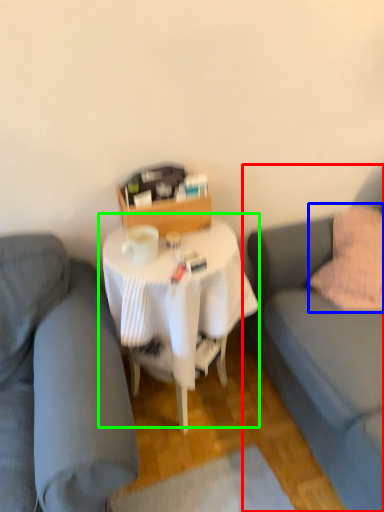
Question: Which object is positioned closest to studio couch (highlighted by a red box)? Select from throw pillow (highlighted by a blue box) and table (highlighted by a green box).

Choices:
 (A) throw pillow
 (B) table

Answer: (A)